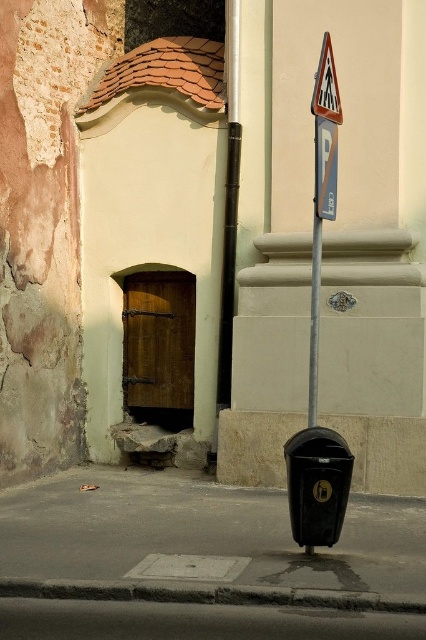
Question: Which point is closer to the camera?

Choices:
 (A) black plastic parking meter at lower center
 (B) dark gray asphalt at lower center
 (C) black asphalt pavement at lower center
 (D) metallic parking sign at center

Answer: (B)

Question: Does black asphalt pavement at lower center have a larger size compared to dark gray asphalt at lower center?

Choices:
 (A) no
 (B) yes

Answer: (B)

Question: Which point is closer to the camera?

Choices:
 (A) (310, 516)
 (B) (52, 624)
 (C) (140, 593)
 (D) (314, 84)

Answer: (B)

Question: Among these points, which one is nearest to the camera?

Choices:
 (A) pyautogui.click(x=291, y=593)
 (B) pyautogui.click(x=325, y=438)
 (C) pyautogui.click(x=37, y=545)
 (D) pyautogui.click(x=247, y=609)

Answer: (A)

Question: Is black asphalt pavement at lower center below gray concrete curb at lower center?

Choices:
 (A) yes
 (B) no

Answer: (A)

Question: Does gray concrete curb at lower center have a smaller size compared to white plastic triangle at upper center?

Choices:
 (A) yes
 (B) no

Answer: (B)